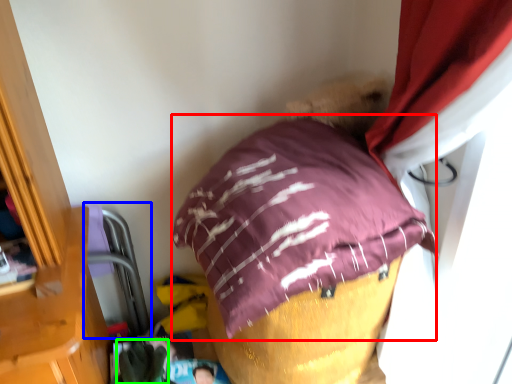
Question: Based on their relative distances, which object is farther from pillow (highlighted by a red box)? Choose from bean bag chair (highlighted by a blue box) and clothing (highlighted by a green box).

Choices:
 (A) bean bag chair
 (B) clothing

Answer: (B)